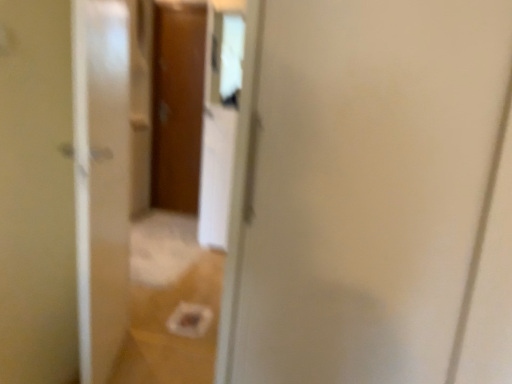
Question: Looking at their shapes, would you say transparent glass screen door at left is wider or thinner than wooden door at center?

Choices:
 (A) thin
 (B) wide

Answer: (B)

Question: Is transparent glass screen door at left situated inside wooden door at center or outside?

Choices:
 (A) inside
 (B) outside

Answer: (B)

Question: Estimate the real-world distances between objects in this image. Which object is farther from the wooden door at center?

Choices:
 (A) transparent glass door at center
 (B) transparent glass screen door at left

Answer: (B)

Question: Which is nearer to the transparent glass door at center?

Choices:
 (A) transparent glass screen door at left
 (B) wooden door at center

Answer: (A)